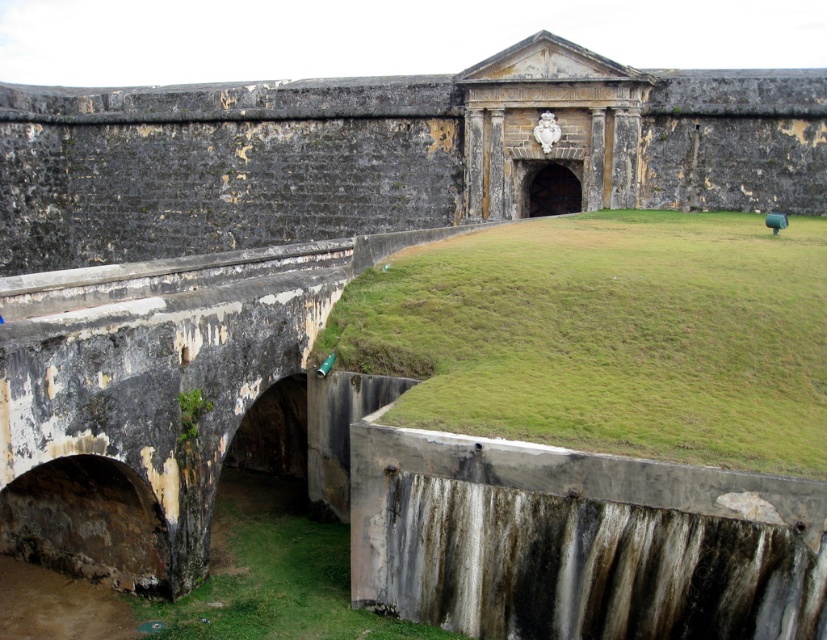
You are a gardener tasked with mowing the green grass at lower right and green grass at lower left. Which area requires more time to mow based on their sizes?

The green grass at lower right requires more time to mow because it is larger in size than the green grass at lower left.

You are standing at the base of the historic fortification and notice two patches of green grass at lower right and green grass at lower left. Which patch is positioned more to the east if the fortification faces north?

The green grass at lower right is positioned more to the east because if the fortification faces north, the right side would correspond to the east direction.